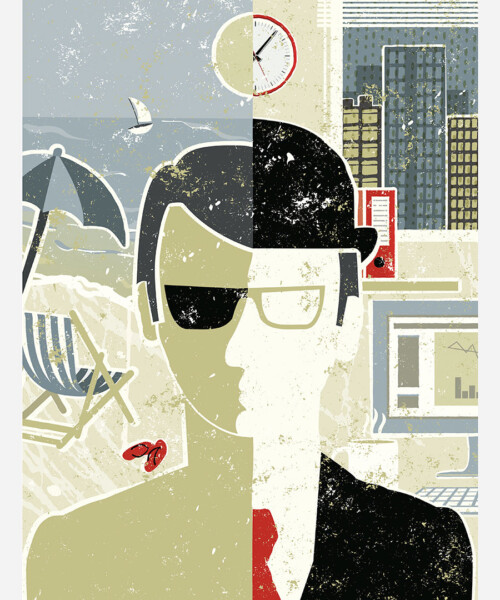
Identify the location of computer. (386, 369).